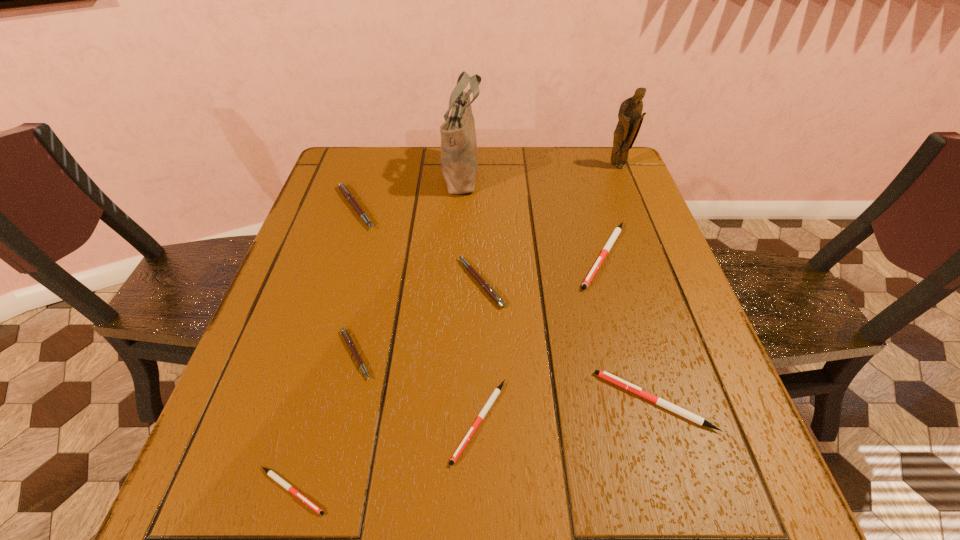
At what (x,y) coordinates should I click in order to perform the action: click on vacant space located 0.330m on the clicker of the third smallest white pen. Please return your answer as a coordinate pair (x, y). Image resolution: width=960 pixels, height=540 pixels. Looking at the image, I should click on (413, 401).

Identify the location of free space located on the clicker of the third smallest white pen. (396, 401).

You are a GUI agent. You are given a task and a screenshot of the screen. Output one action in this format:
    pyautogui.click(x=<x>, y=<y>)
    Task: Click on the vacant region located at the nib of the smallest pink pen
    
    Given the screenshot: What is the action you would take?
    pyautogui.click(x=567, y=354)

Identify the location of vacant area situated 0.090m on the clicker of the second white pen from left to right. This screenshot has width=960, height=540. (479, 530).

This screenshot has width=960, height=540. Identify the location of vacant region located 0.220m on the clicker of the smallest white pen. (473, 491).

The width and height of the screenshot is (960, 540). I want to click on shoulder bag situated at the far edge, so click(x=459, y=159).

I want to click on figurine present at the far edge, so click(x=630, y=116).

The width and height of the screenshot is (960, 540). I want to click on pen situated at the far edge, so click(x=350, y=198).

Find the location of a particular element. Image resolution: width=960 pixels, height=540 pixels. object located at the near edge is located at coordinates (287, 486).

Locate an element on the screen. This screenshot has height=540, width=960. figurine that is positioned at the right edge is located at coordinates (630, 116).